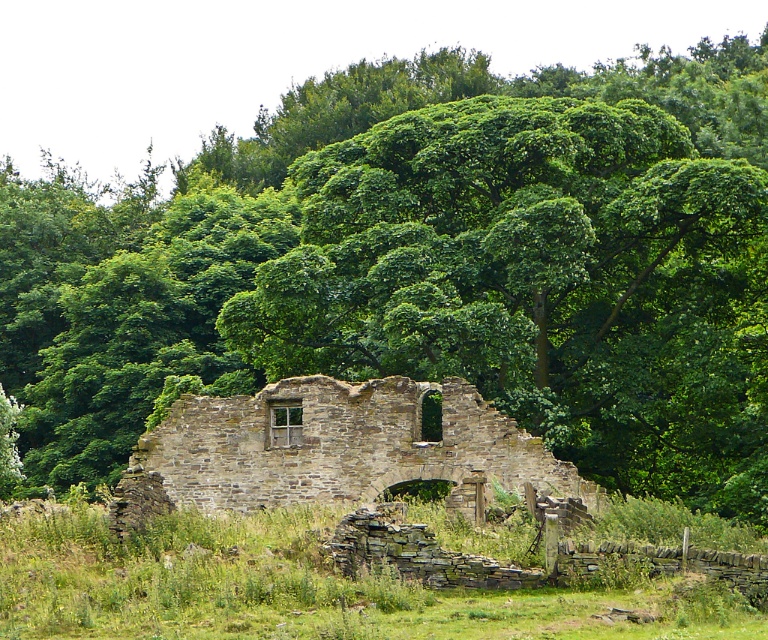
Question: Can you confirm if green grass at center is positioned above rustic stone ruins at center?

Choices:
 (A) no
 (B) yes

Answer: (A)

Question: Which of the following is the closest to the observer?

Choices:
 (A) (220, 576)
 (B) (325, 422)

Answer: (A)

Question: In this image, where is green grass at center located relative to rustic stone ruins at center?

Choices:
 (A) left
 (B) right

Answer: (A)

Question: Does green grass at center have a larger size compared to rustic stone ruins at center?

Choices:
 (A) yes
 (B) no

Answer: (A)